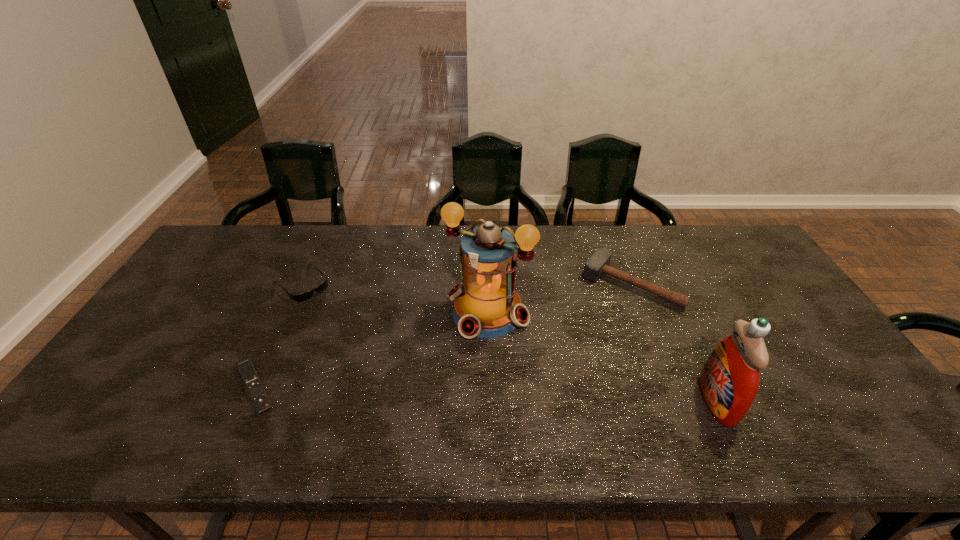
The image size is (960, 540). Find the location of `remote control`. remote control is located at coordinates (252, 382).

You are a GUI agent. You are given a task and a screenshot of the screen. Output one action in this format:
    pyautogui.click(x=<x>, y=<y>)
    Task: Click on the fourth shortest object
    Image resolution: width=960 pixels, height=540 pixels.
    Given the screenshot: What is the action you would take?
    pyautogui.click(x=729, y=381)

Image resolution: width=960 pixels, height=540 pixels. Find the location of `the second shortest object`. the second shortest object is located at coordinates (302, 297).

The width and height of the screenshot is (960, 540). I want to click on hammer, so click(598, 264).

At what (x,y) coordinates should I click in order to perform the action: click on the third object from left to right. Please return your answer as a coordinate pair (x, y). The image size is (960, 540). Looking at the image, I should click on (486, 305).

Image resolution: width=960 pixels, height=540 pixels. I want to click on the tallest object, so click(486, 305).

Identify the location of free space located on the back of the remote control. Image resolution: width=960 pixels, height=540 pixels. (281, 330).

Identify the location of free space located 0.120m on the front surface of the detergent. (652, 401).

Where is `free point located on the front surface of the detergent`? free point located on the front surface of the detergent is located at coordinates (669, 401).

Where is `free spot located 0.350m on the front surface of the detergent`? This screenshot has width=960, height=540. free spot located 0.350m on the front surface of the detergent is located at coordinates (557, 401).